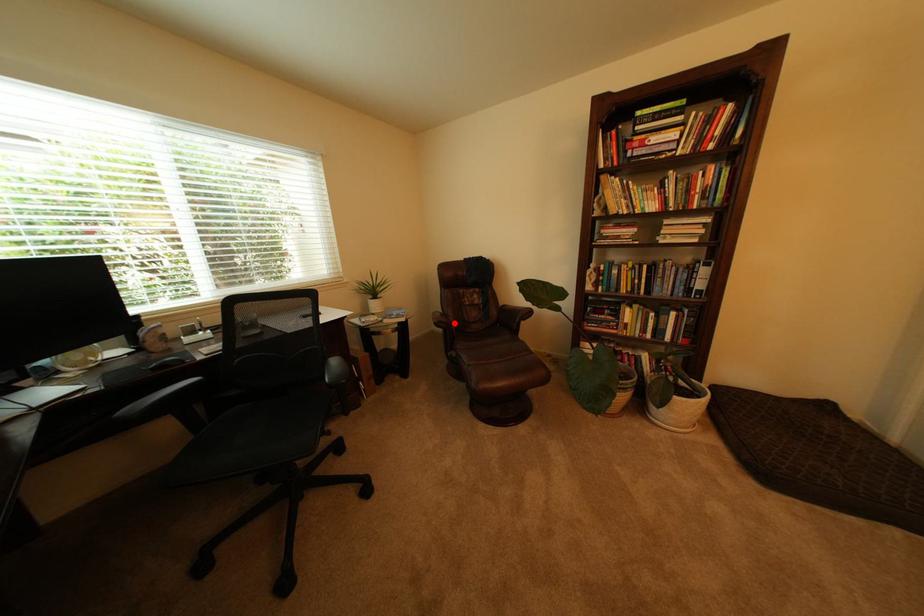
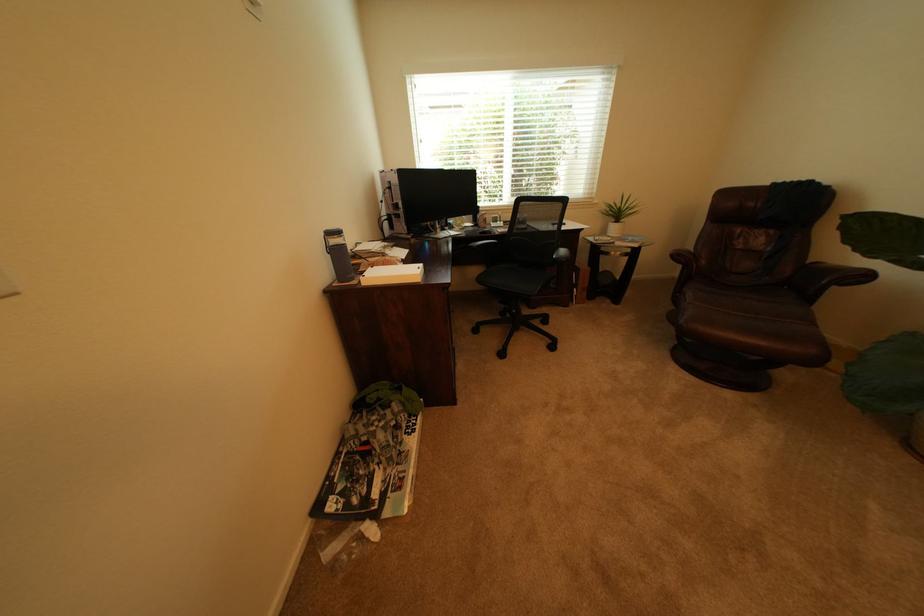
Question: I am providing you with two images of the same scene from different viewpoints. A red point is marked on the first image. Can you still see the location of the red point in image 2?

Choices:
 (A) Yes
 (B) No

Answer: (A)